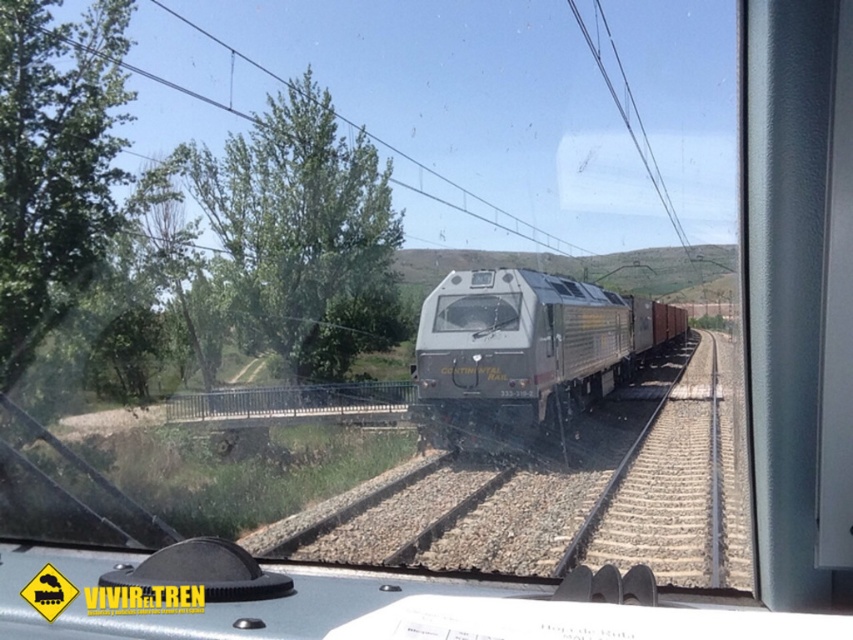
Who is higher up, green leafy tree at upper left or metallic wire at upper center?

metallic wire at upper center is higher up.

Which of these two, green leafy tree at upper left or metallic wire at upper center, stands shorter?

metallic wire at upper center

Which is in front, point (376, 342) or point (460, 211)?

Point (376, 342) is in front.

Image resolution: width=853 pixels, height=640 pixels. I want to click on green leafy tree at upper left, so [x=302, y=234].

Does metallic silver train at center have a lesser width compared to metallic wire at upper center?

Correct, metallic silver train at center's width is less than metallic wire at upper center's.

Is point (543, 282) positioned before point (352, 124)?

Yes, point (543, 282) is closer to viewer.

Who is more forward, [553,381] or [535,237]?

Point [553,381] is more forward.

In order to click on metallic silver train at center in this screenshot , I will do `click(525, 353)`.

Does green leafy tree at upper left appear on the left side of metallic silver train at center?

Correct, you'll find green leafy tree at upper left to the left of metallic silver train at center.

Does green leafy tree at upper left appear on the right side of metallic silver train at center?

No, green leafy tree at upper left is not to the right of metallic silver train at center.

Is point (277, 225) less distant than point (444, 349)?

No, it is behind (444, 349).

Locate an element on the screen. This screenshot has width=853, height=640. green leafy tree at upper left is located at coordinates (302, 234).